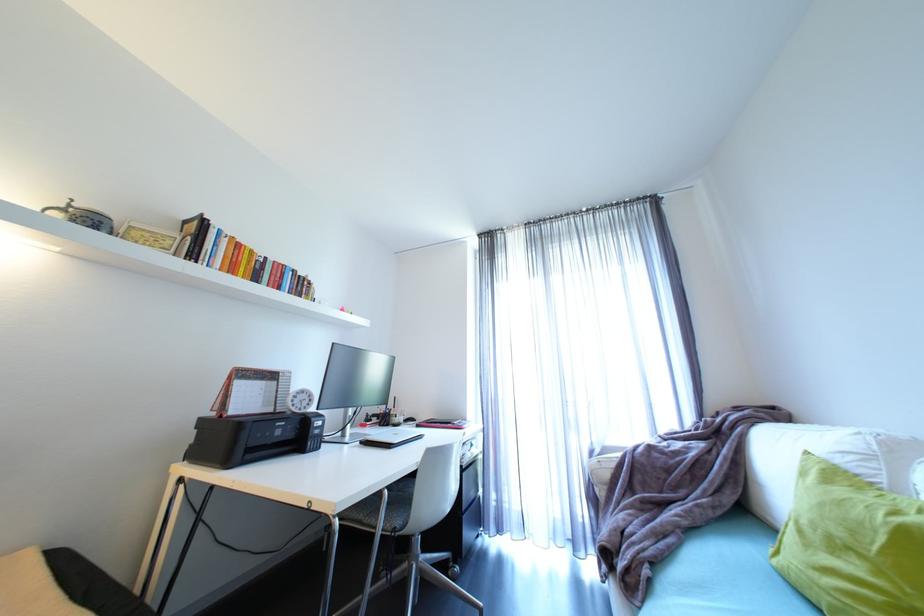
The height and width of the screenshot is (616, 924). What do you see at coordinates (383, 508) in the screenshot?
I see `a chair sitting surface` at bounding box center [383, 508].